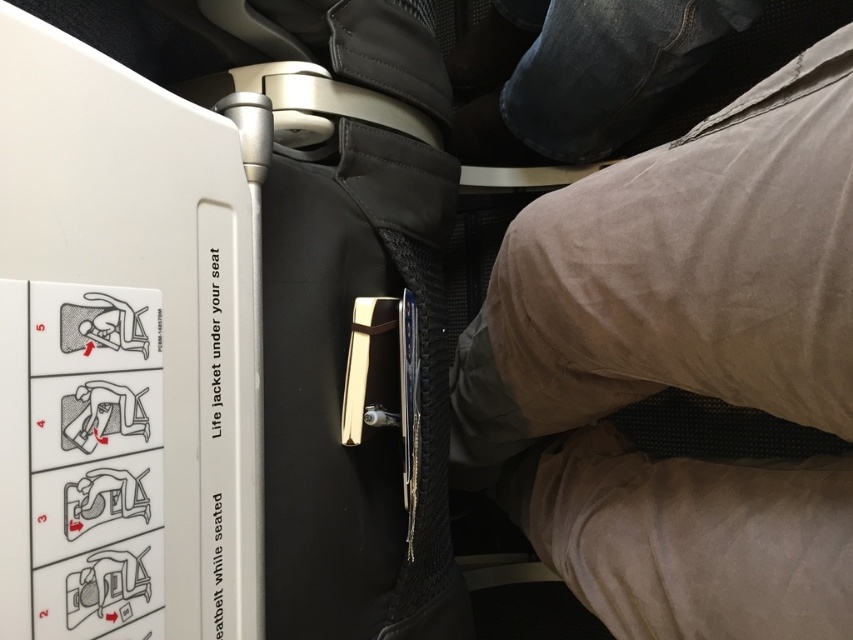
From the picture: You are sitting in an airplane seat and need to locate the black mesh bag at center. Where should you look relative to the white panel with instructions on the left side?

The black mesh bag at center is located to the right of the white panel with instructions on the left side since its 2D coordinates are at a higher x value than the panel.

You are a flight attendant checking the distance between the white panel with life jacket instructions and the black mesh bag at center. The airline requires that safety information must be within 12 inches of the life jacket storage location. Does this setup comply with the regulation?

The white panel with life jacket instructions and the black mesh bag at center are 13.45 inches apart. Since the required distance is 12 inches, this setup does not comply with the airline regulation.